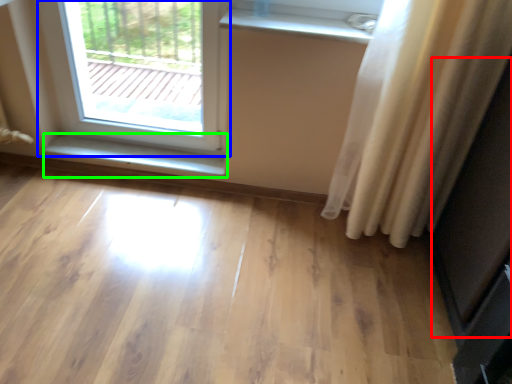
Question: Which is nearer to the screen door (highlighted by a red box)? window (highlighted by a blue box) or window sill (highlighted by a green box).

Choices:
 (A) window
 (B) window sill

Answer: (B)